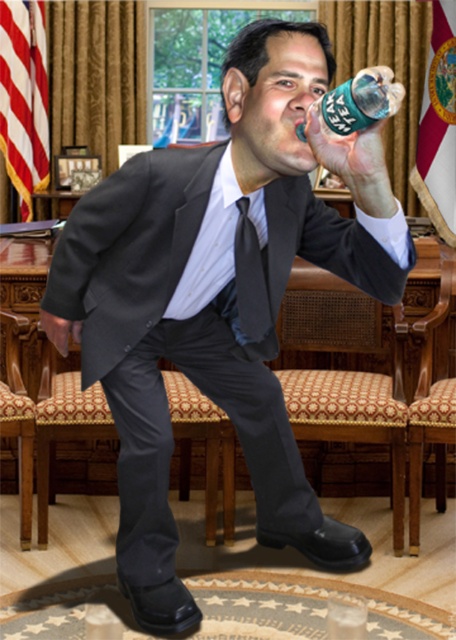
Consider the image. You are standing in the room and want to sit down. Where is the woven fabric chair at center located?

The woven fabric chair at center is located at point 0.650 on the x axis and 0.776 on the y axis.

You are standing in the government office scene. There are two points marked in the image, one at coordinates point (402, 529) and another at point (421, 348). Which point is closer to you?

Point (402, 529) is closer to the viewer than point (421, 348).

You are a maintenance worker needing to place a 2.5 meter long ladder between the fabric upholstered chair at center and the green plastic bottle at upper center. Is there enough space to place the ladder horizontally between them?

The fabric upholstered chair at center and green plastic bottle at upper center are 2.48 meters apart, so the ladder is slightly longer than the distance between them. Therefore, there is not enough space to place the ladder horizontally between them.